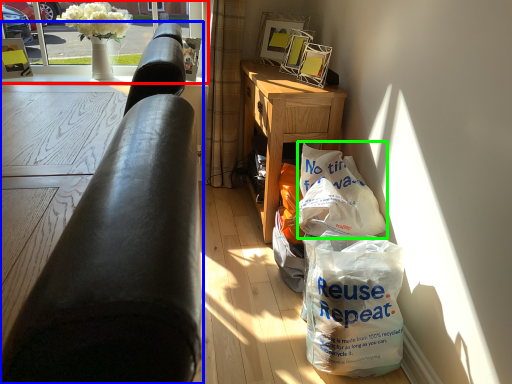
Question: Which object is positioned closest to window screen (highlighted by a red box)? Select from studio couch (highlighted by a blue box) and grocery bag (highlighted by a green box).

Choices:
 (A) studio couch
 (B) grocery bag

Answer: (B)